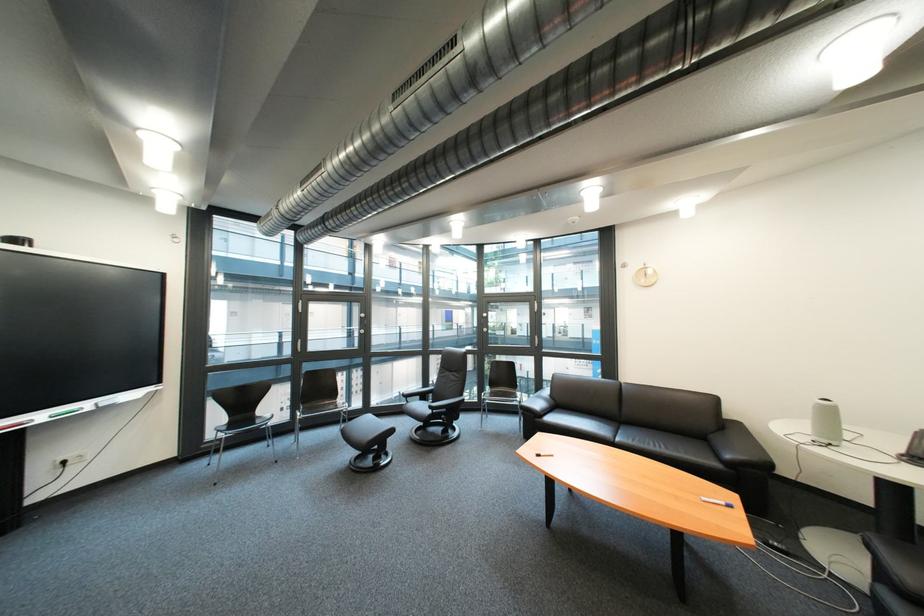
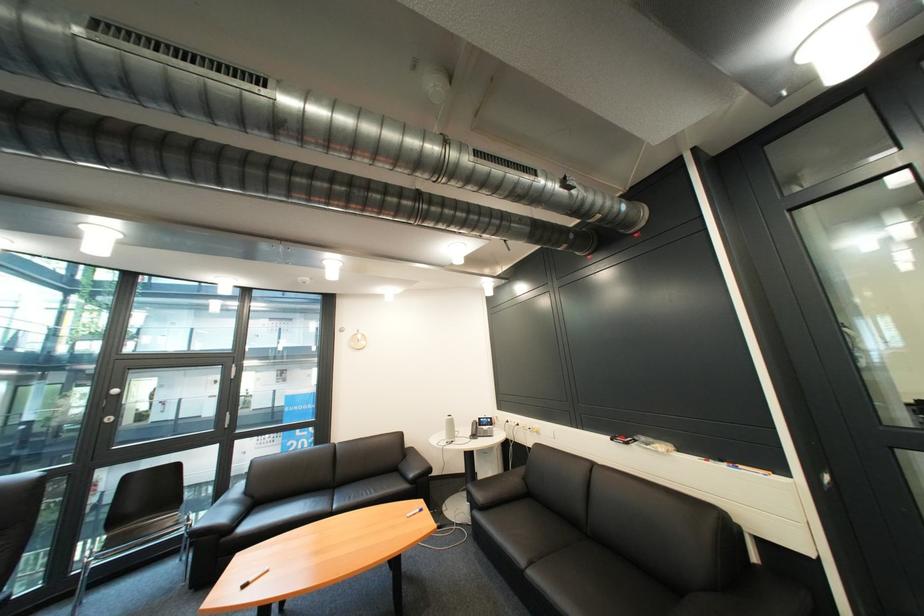
The point at [496,323] is marked in the first image. Where is the corresponding point in the second image?

(118, 408)